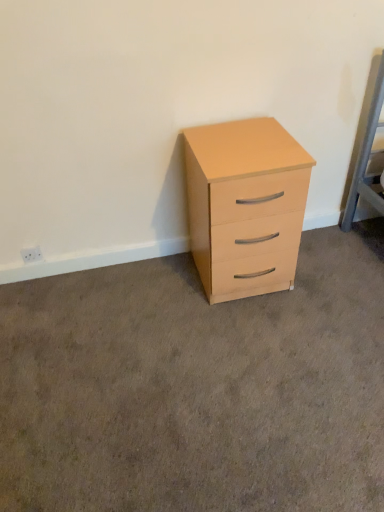
At what (x,y) coordinates should I click in order to perform the action: click on vacant space situated on the left part of light wood/finish chest of drawers at center. Please return your answer as a coordinate pair (x, y). This screenshot has width=384, height=512. Looking at the image, I should click on (160, 289).